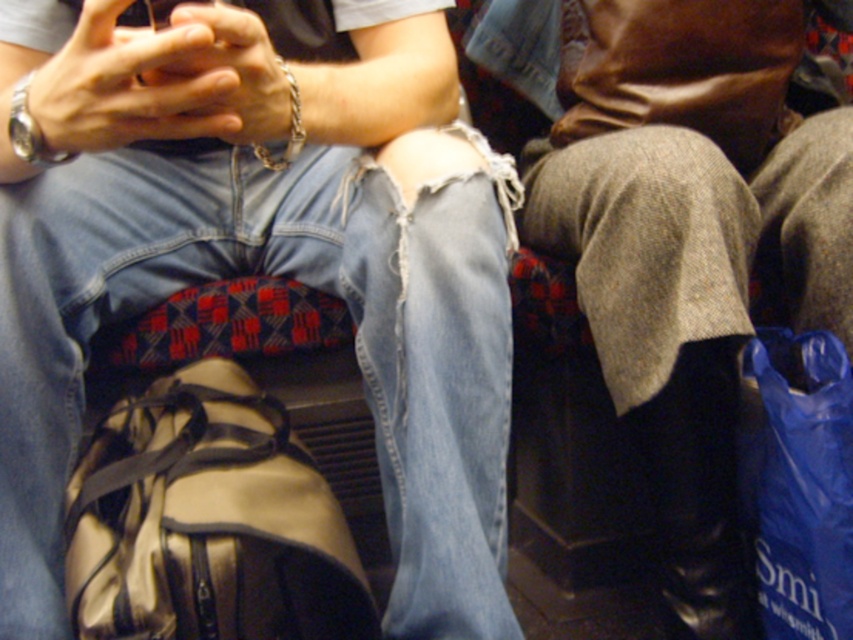
You are organizing a backpacking trip and need to choose between the shiny metallic bag at center and the blue plastic bag at lower right. Based on their sizes, which one can hold more items?

The shiny metallic bag at center might be wider than blue plastic bag at lower right, so it can potentially hold more items.

You are organizing a small event and need to place a 24 inch long object between the shiny metallic bag at center and the camera. Is there enough space?

The distance between the shiny metallic bag at center and the camera is 26.10 inches, so yes, there is enough space to place a 24 inch long object between them.